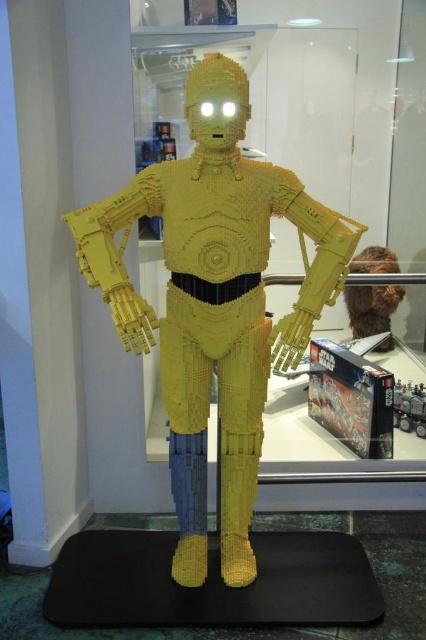
Does point (374, 300) lie behind point (394, 412)?

No, it is in front of (394, 412).

What do you see at coordinates (371, 307) in the screenshot? I see `brown fuzzy wig at upper right` at bounding box center [371, 307].

Locate an element on the screen. brown fuzzy wig at upper right is located at coordinates (371, 307).

Can you confirm if yellow lego robot at center is shorter than brown fuzzy wig at upper right?

No, yellow lego robot at center is not shorter than brown fuzzy wig at upper right.

Is point (184, 433) closer to viewer compared to point (394, 308)?

Yes, point (184, 433) is closer to viewer.

Is point (230, 134) behind point (376, 266)?

No.

You are a GUI agent. You are given a task and a screenshot of the screen. Output one action in this format:
    pyautogui.click(x=<x>, y=<y>)
    Task: Click on the yellow lego robot at center
    Image resolution: width=426 pixels, height=640 pixels.
    Given the screenshot: What is the action you would take?
    pyautogui.click(x=215, y=301)

Between yellow lego robot at center and brick-like yellow robot at center, which one appears on the right side from the viewer's perspective?

brick-like yellow robot at center

Can you confirm if yellow lego robot at center is thinner than brick-like yellow robot at center?

In fact, yellow lego robot at center might be wider than brick-like yellow robot at center.

The height and width of the screenshot is (640, 426). What do you see at coordinates (215, 301) in the screenshot?
I see `yellow lego robot at center` at bounding box center [215, 301].

The height and width of the screenshot is (640, 426). I want to click on yellow lego robot at center, so click(x=215, y=301).